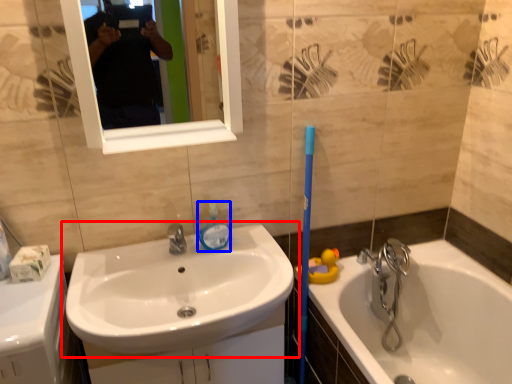
Question: Which object is further to the camera taking this photo, sink (highlighted by a red box) or soap dispenser (highlighted by a blue box)?

Choices:
 (A) sink
 (B) soap dispenser

Answer: (B)